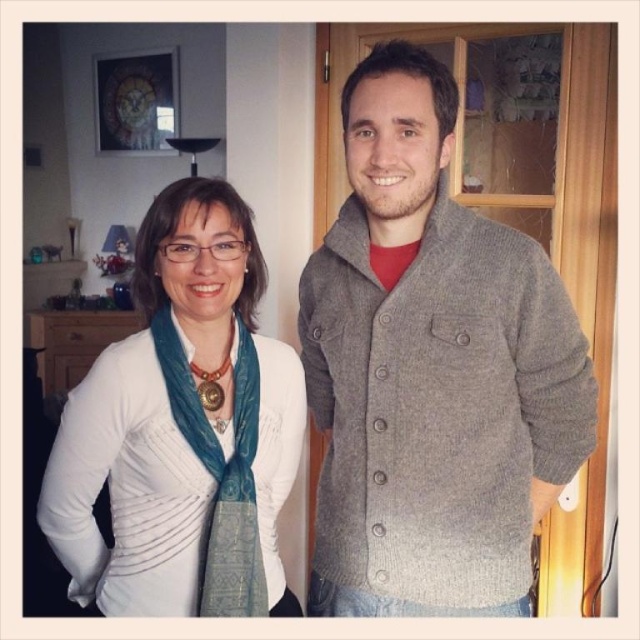
Does gray woolen sweater at center have a smaller size compared to white matte scarf at left?

No, gray woolen sweater at center is not smaller than white matte scarf at left.

Is gray woolen sweater at center above white matte scarf at left?

Indeed, gray woolen sweater at center is positioned over white matte scarf at left.

What do you see at coordinates (432, 371) in the screenshot? I see `gray woolen sweater at center` at bounding box center [432, 371].

Find the location of a particular element. The height and width of the screenshot is (640, 640). gray woolen sweater at center is located at coordinates (432, 371).